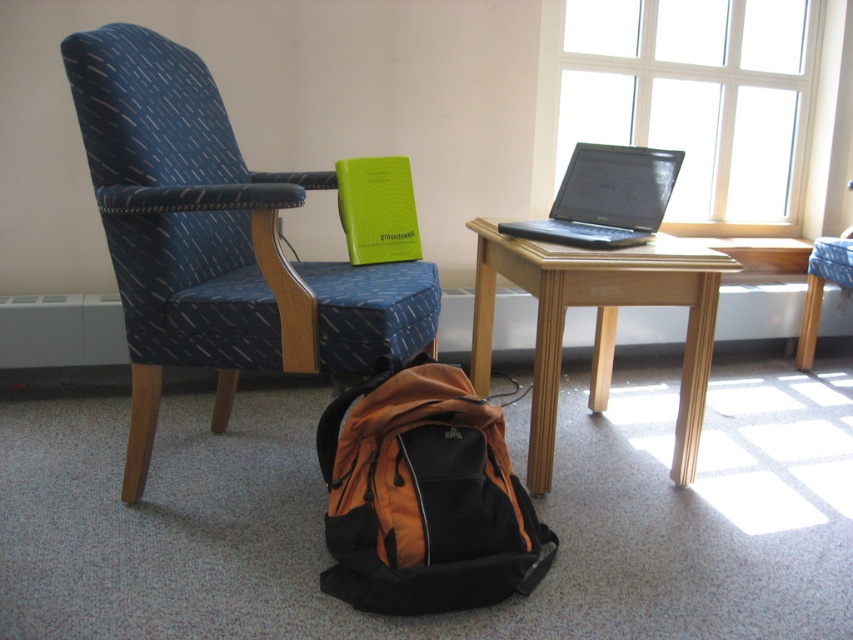
Is the position of black glossy laptop at center less distant than that of blue fabric stool at lower right?

Yes, it is in front of blue fabric stool at lower right.

Can you confirm if black glossy laptop at center is thinner than blue fabric stool at lower right?

Incorrect, black glossy laptop at center's width is not less than blue fabric stool at lower right's.

Which is behind, point (631, 148) or point (805, 362)?

Point (805, 362)

In order to click on black glossy laptop at center in this screenshot , I will do click(x=606, y=196).

How distant is blue fabric armchair at left from blue fabric stool at lower right?

blue fabric armchair at left and blue fabric stool at lower right are 1.74 meters apart.

Can you confirm if blue fabric armchair at left is thinner than blue fabric stool at lower right?

In fact, blue fabric armchair at left might be wider than blue fabric stool at lower right.

Identify the location of blue fabric armchair at left. This screenshot has height=640, width=853. (216, 241).

Between orange fabric backpack at lower center and wooden table at center, which one appears on the right side from the viewer's perspective?

wooden table at center is more to the right.

Which of these two, orange fabric backpack at lower center or wooden table at center, stands shorter?

orange fabric backpack at lower center is shorter.

Identify the location of orange fabric backpack at lower center. (424, 497).